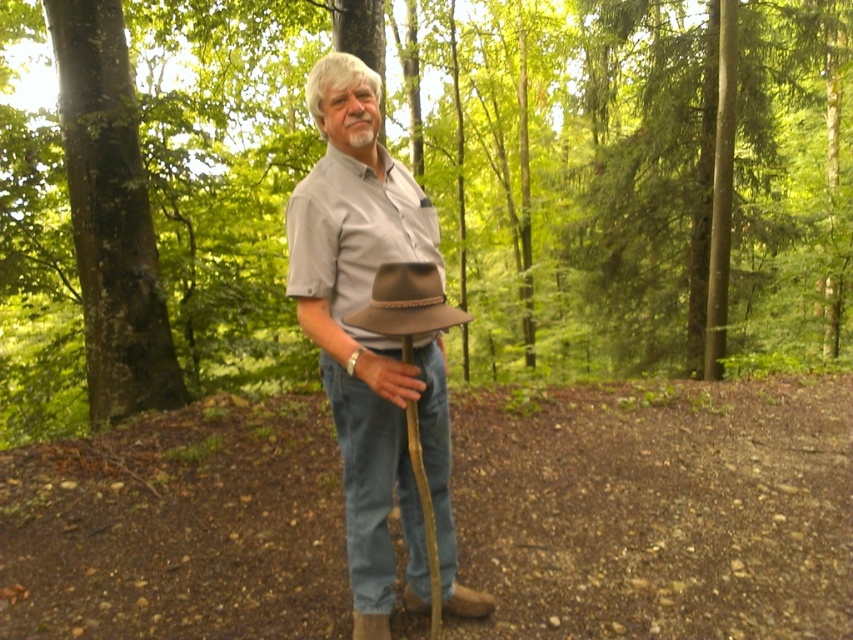
Is point (386, 364) more distant than point (132, 80)?

No, it is in front of (132, 80).

Measure the distance between point (x=407, y=506) and camera.

The distance of point (x=407, y=506) from camera is 3.00 meters.

Is point (437, 417) closer to camera compared to point (59, 19)?

That is True.

You are a GUI agent. You are given a task and a screenshot of the screen. Output one action in this format:
    pyautogui.click(x=<x>, y=<y>)
    Task: Click on the brown felt hat at center
    
    Given the screenshot: What is the action you would take?
    pyautogui.click(x=372, y=346)

Measure the distance between brown textured hat at center and camera.

brown textured hat at center is 2.66 meters away from camera.

Does brown textured hat at center lie behind green rough bark tree at left?

No, brown textured hat at center is in front of green rough bark tree at left.

Is point (421, 42) positioned in front of point (80, 74)?

That is False.

The image size is (853, 640). Find the location of `brown textured hat at center`. brown textured hat at center is located at coordinates (424, 188).

Is brown textured hat at center wider than brown felt hat at center?

Yes, brown textured hat at center is wider than brown felt hat at center.

Does point (524, 154) lie behind point (368, 556)?

Yes, point (524, 154) is behind point (368, 556).

This screenshot has width=853, height=640. What do you see at coordinates (424, 188) in the screenshot?
I see `brown textured hat at center` at bounding box center [424, 188].

Find the location of a particular element. This screenshot has width=853, height=640. brown textured hat at center is located at coordinates (424, 188).